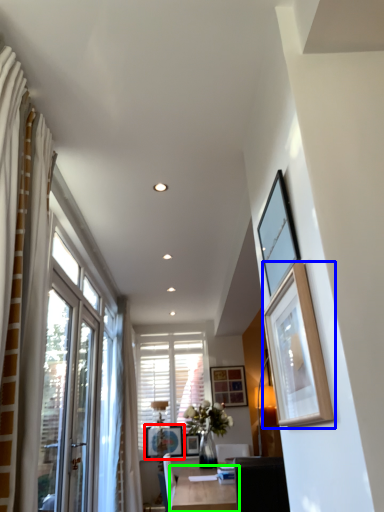
Question: Which object is the closest to the picture frame (highlighted by a red box)? Choose among these: picture frame (highlighted by a blue box) or table (highlighted by a green box).

Choices:
 (A) picture frame
 (B) table

Answer: (B)